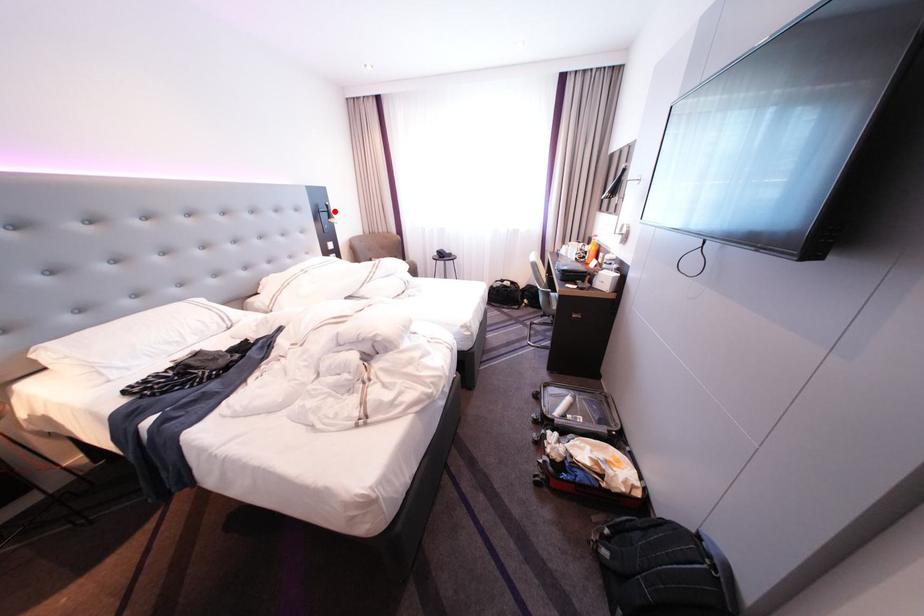
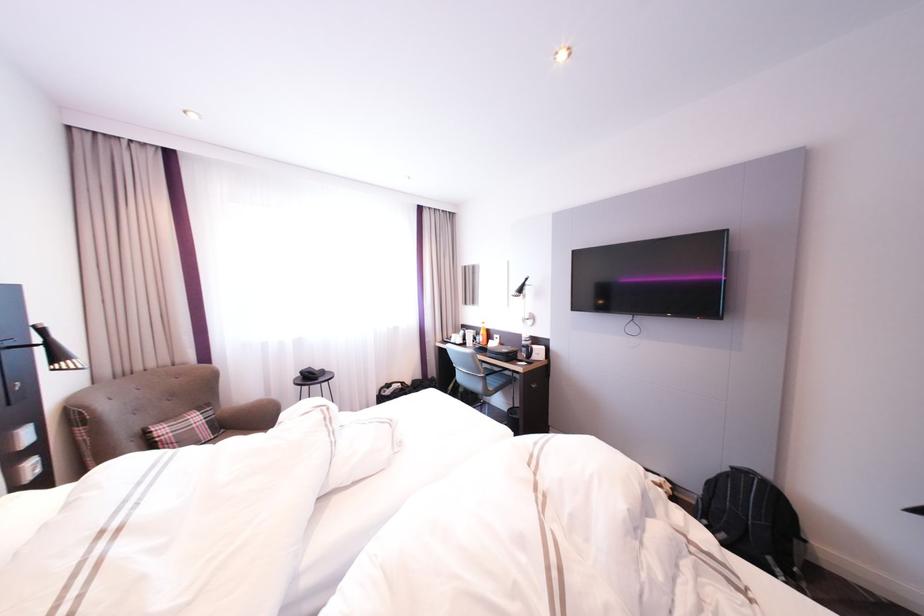
Question: I am providing you with two images of the same scene from different viewpoints. Given a red point in image1, look at the same physical point in image2. Is it:

Choices:
 (A) Closer to the viewpoint
 (B) Farther from the viewpoint

Answer: (B)